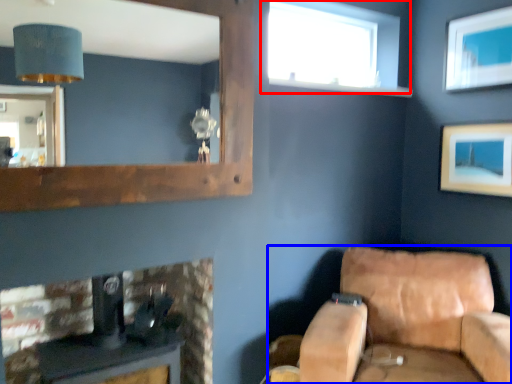
Question: Which object appears farthest to the camera in this image, window (highlighted by a red box) or studio couch (highlighted by a blue box)?

Choices:
 (A) window
 (B) studio couch

Answer: (A)